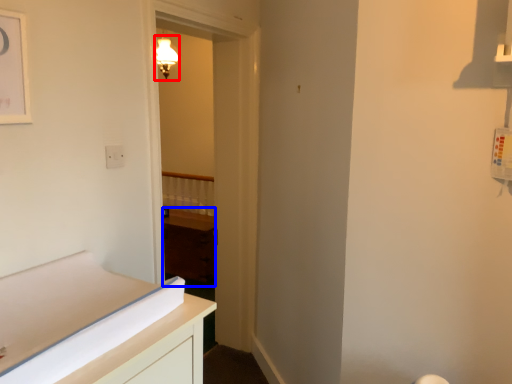
Question: Among these objects, which one is nearest to the camera, light fixture (highlighted by a red box) or cabinetry (highlighted by a blue box)?

Choices:
 (A) light fixture
 (B) cabinetry

Answer: (B)